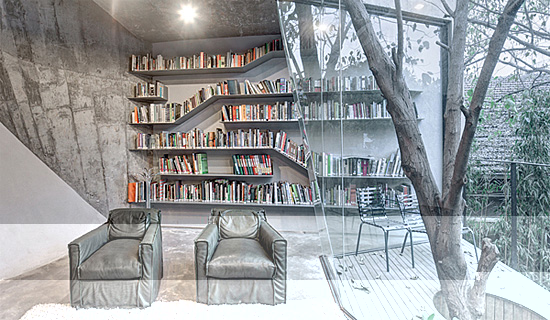
Identify the location of chair. The image size is (550, 320). (417, 228).